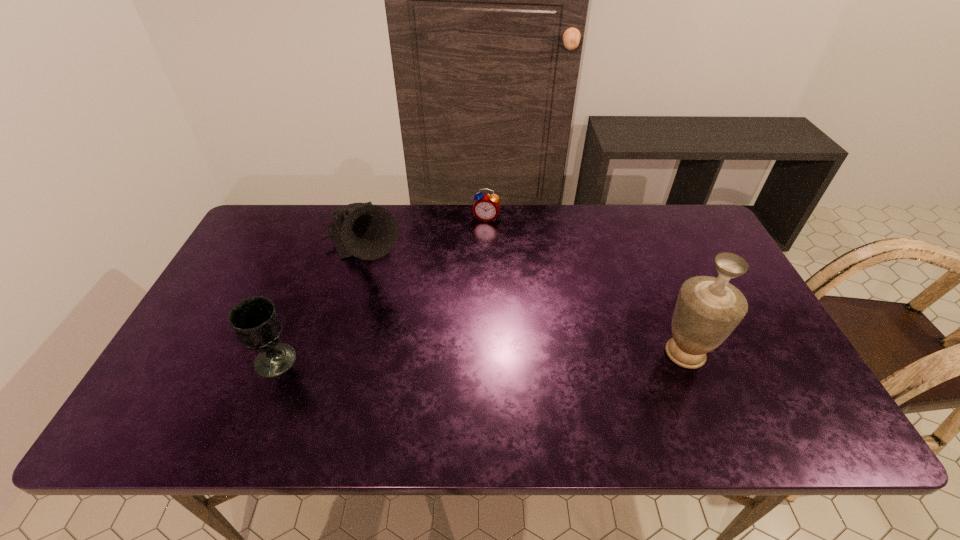
Locate an element on the screen. The width and height of the screenshot is (960, 540). free spot at the right edge of the desktop is located at coordinates (738, 287).

This screenshot has height=540, width=960. In the image, there is a desktop. What are the coordinates of `vacant space at the far left corner` in the screenshot? It's located at (276, 227).

Locate an element on the screen. free region at the near right corner of the desktop is located at coordinates (732, 379).

Where is `empty location between the chalice and the alarm clock`? This screenshot has height=540, width=960. empty location between the chalice and the alarm clock is located at coordinates (381, 289).

You are a GUI agent. You are given a task and a screenshot of the screen. Output one action in this format:
    pyautogui.click(x=<x>, y=<y>)
    Task: Click on the empty space between the urn and the third shortest object
    The height and width of the screenshot is (540, 960).
    Given the screenshot: What is the action you would take?
    pyautogui.click(x=525, y=302)

Find the location of a particular element. blank region between the second tallest object and the second shortest object is located at coordinates (321, 306).

Where is `vacant area that lies between the third shortest object and the rightmost object`? The width and height of the screenshot is (960, 540). vacant area that lies between the third shortest object and the rightmost object is located at coordinates (525, 302).

This screenshot has height=540, width=960. Identify the location of free space between the second shortest object and the urn. pos(481,357).

You are a GUI agent. You are given a task and a screenshot of the screen. Output one action in this format:
    pyautogui.click(x=<x>, y=<y>)
    Task: Click on the vacant area between the rightmost object and the shortest object
    Image resolution: width=960 pixels, height=540 pixels.
    Given the screenshot: What is the action you would take?
    coord(586,286)

You are a GUI agent. You are given a task and a screenshot of the screen. Output one action in this format:
    pyautogui.click(x=<x>, y=<y>)
    Task: Click on the free area in between the chalice and the alarm clock
    
    Given the screenshot: What is the action you would take?
    pyautogui.click(x=381, y=289)